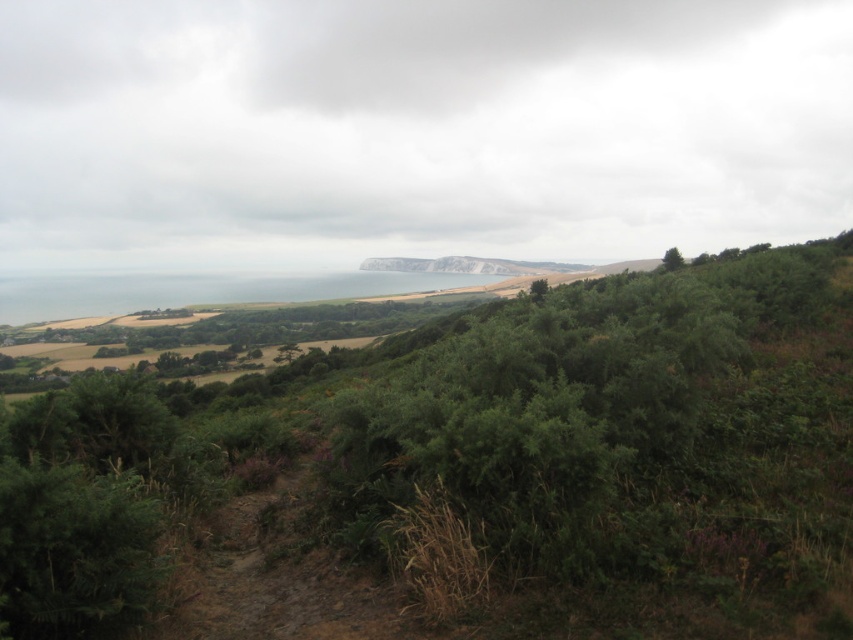
Question: Does green leafy tree at upper right lie in front of green leafy tree at center?

Choices:
 (A) no
 (B) yes

Answer: (A)

Question: Observing the image, what is the correct spatial positioning of green leafy tree at upper right in reference to green leafy tree at center?

Choices:
 (A) above
 (B) below

Answer: (A)

Question: Does green leafy tree at upper right appear under green leafy tree at center?

Choices:
 (A) yes
 (B) no

Answer: (B)